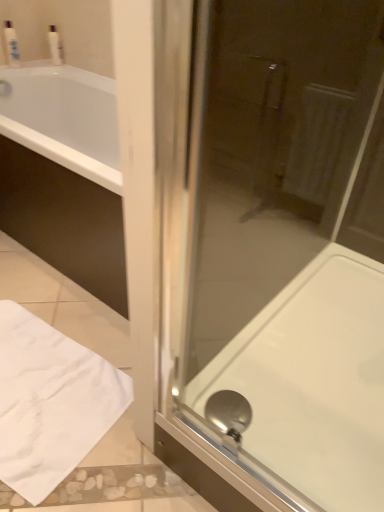
Where is `empty space that is to the right of white plastic bottle at upper left, which appears as the second toiletry when viewed from the right`? This screenshot has height=512, width=384. empty space that is to the right of white plastic bottle at upper left, which appears as the second toiletry when viewed from the right is located at coordinates (41, 68).